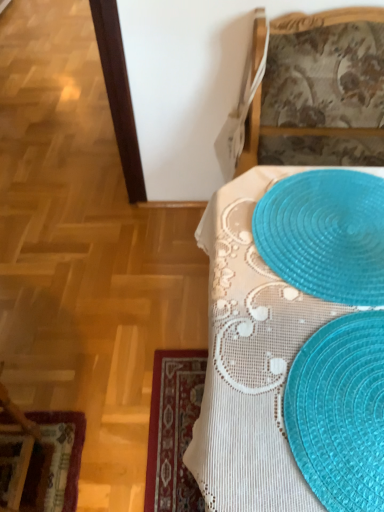
The width and height of the screenshot is (384, 512). Find the location of `free location to the right of velvet burgundy placemat at lower left`. free location to the right of velvet burgundy placemat at lower left is located at coordinates (119, 446).